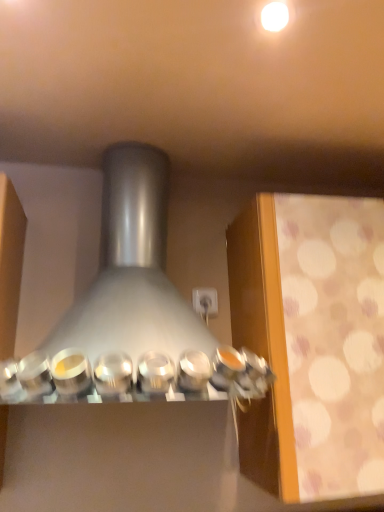
The image size is (384, 512). What are the coordinates of `blank area to the left of white glossy light bulb at upper center` in the screenshot? It's located at (193, 39).